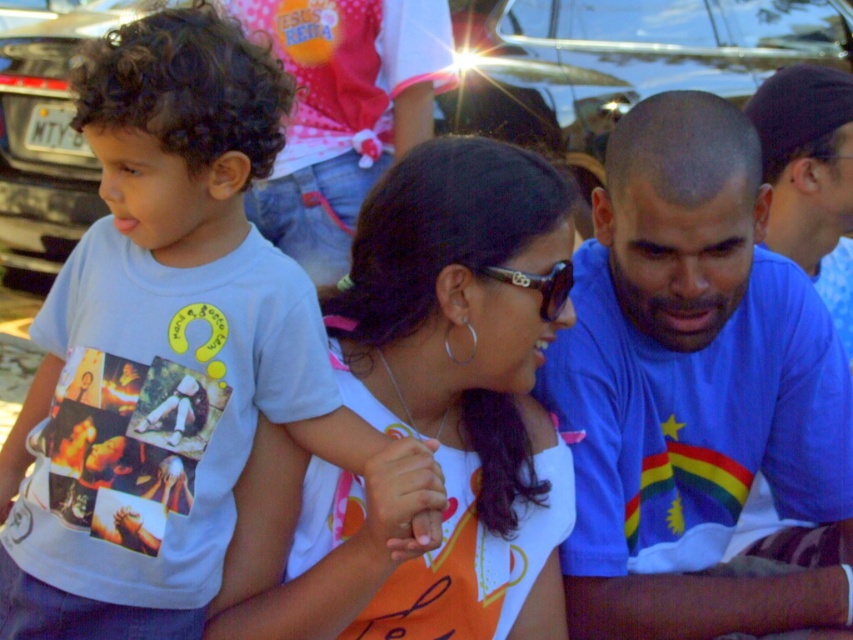
Question: Does white cotton shirt at center appear under shiny black car at upper center?

Choices:
 (A) yes
 (B) no

Answer: (A)

Question: Among these points, which one is nearest to the camera?

Choices:
 (A) (645, 438)
 (B) (303, 344)

Answer: (B)

Question: From the image, what is the correct spatial relationship of shiny black car at upper center in relation to sunglasses at center?

Choices:
 (A) below
 (B) above

Answer: (B)

Question: Does white printed t-shirt at left have a larger size compared to blue cotton shirt at center?

Choices:
 (A) yes
 (B) no

Answer: (B)

Question: Which point appears closest to the camera in this image?

Choices:
 (A) (514, 298)
 (B) (155, 92)
 (C) (602, 554)

Answer: (B)

Question: Which object is closer to the camera taking this photo?

Choices:
 (A) white cotton shirt at center
 (B) sunglasses at center

Answer: (A)